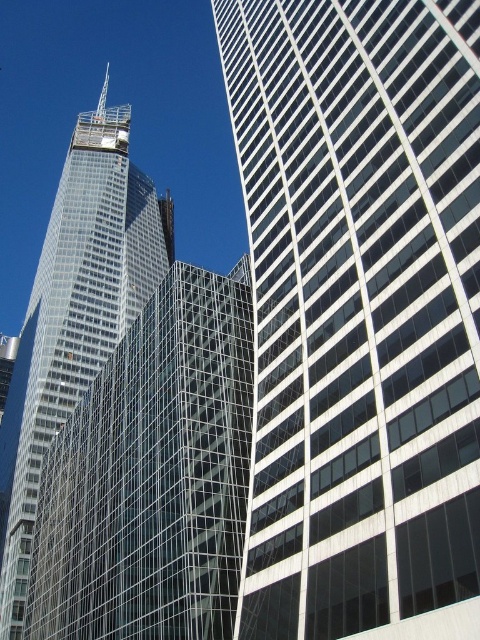
Question: Which point is farther to the camera?

Choices:
 (A) transparent glass building at center
 (B) clear glass skyscraper at left
 (C) glassy reflective skyscraper at right

Answer: (B)

Question: Is glassy reflective skyscraper at right smaller than transparent glass building at center?

Choices:
 (A) yes
 (B) no

Answer: (B)

Question: Can you confirm if glassy reflective skyscraper at right is thinner than transparent glass building at center?

Choices:
 (A) no
 (B) yes

Answer: (B)

Question: Observing the image, what is the correct spatial positioning of transparent glass building at center in reference to clear glass skyscraper at left?

Choices:
 (A) below
 (B) above

Answer: (A)

Question: Which object appears farthest from the camera in this image?

Choices:
 (A) glassy reflective skyscraper at right
 (B) clear glass skyscraper at left

Answer: (B)

Question: Considering the real-world distances, which object is farthest from the clear glass skyscraper at left?

Choices:
 (A) transparent glass building at center
 (B) glassy reflective skyscraper at right

Answer: (B)